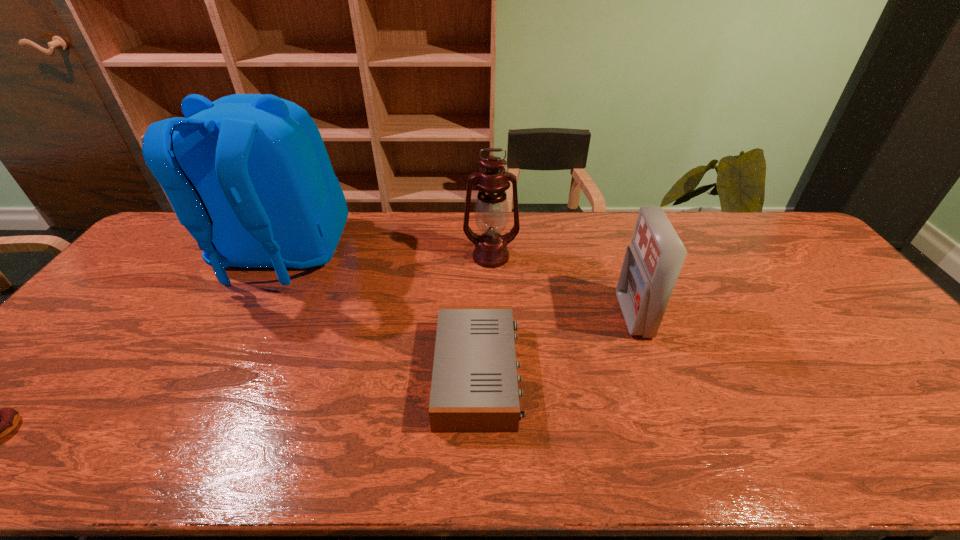
I want to click on backpack, so (248, 175).

Locate an element on the screen. The image size is (960, 540). the tallest object is located at coordinates (248, 175).

This screenshot has height=540, width=960. What are the coordinates of `oil lamp` in the screenshot? It's located at (491, 211).

Locate an element on the screen. the rightmost object is located at coordinates (652, 263).

Where is `the first-aid kit`? The image size is (960, 540). the first-aid kit is located at coordinates (652, 263).

You are a GUI agent. You are given a task and a screenshot of the screen. Output one action in this format:
    pyautogui.click(x=<x>, y=<y>)
    Task: Click on the fourth tallest object
    The height and width of the screenshot is (540, 960).
    Given the screenshot: What is the action you would take?
    pyautogui.click(x=474, y=388)

The image size is (960, 540). I want to click on vacant space located on the back of the backpack, so click(x=212, y=381).

Where is `free space located on the front of the fourth shortest object`? free space located on the front of the fourth shortest object is located at coordinates (493, 329).

You are a GUI agent. You are given a task and a screenshot of the screen. Output one action in this format:
    pyautogui.click(x=<x>, y=<y>)
    Task: Click on the vacant position located 0.280m on the front-facing side of the third tallest object
    This screenshot has width=960, height=540.
    Given the screenshot: What is the action you would take?
    pyautogui.click(x=522, y=315)

At what (x,y) coordinates should I click in order to perform the action: click on vacant space located 0.150m on the front-facing side of the third tallest object. Please return your answer as a coordinate pair (x, y). Looking at the image, I should click on (568, 315).